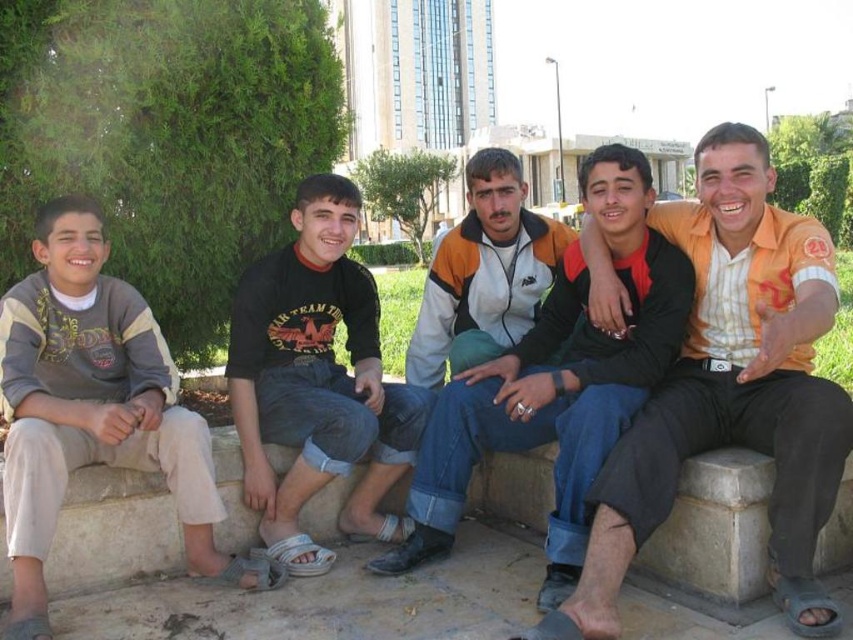
Question: Does orange striped shirt at center appear on the left side of gray cotton pants at left?

Choices:
 (A) yes
 (B) no

Answer: (B)

Question: Which of the following is the farthest from the observer?

Choices:
 (A) (361, 337)
 (B) (30, 497)
 (C) (757, 410)
 (D) (577, 547)

Answer: (A)

Question: Can you confirm if gray cotton pants at left is positioned to the right of orange and white jacket at center?

Choices:
 (A) yes
 (B) no

Answer: (B)

Question: Is orange and white jacket at center positioned at the back of black cotton shirt at center?

Choices:
 (A) no
 (B) yes

Answer: (A)

Question: Which object is the closest to the black cotton shirt at center?

Choices:
 (A) gray cotton pants at left
 (B) orange and white jacket at center
 (C) orange striped shirt at center

Answer: (A)

Question: Among these objects, which one is farthest from the camera?

Choices:
 (A) gray cotton pants at left
 (B) orange striped shirt at center
 (C) black cotton shirt at center

Answer: (C)